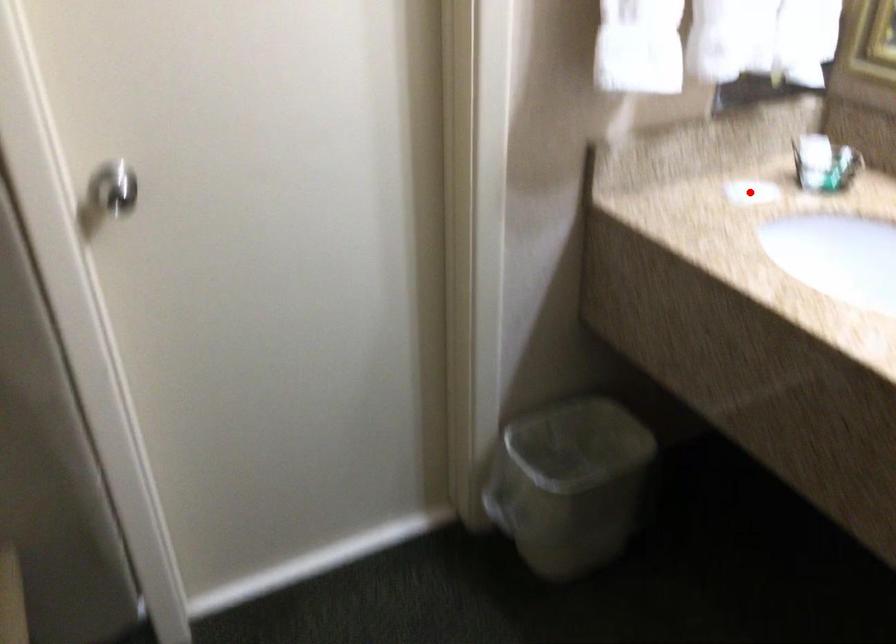
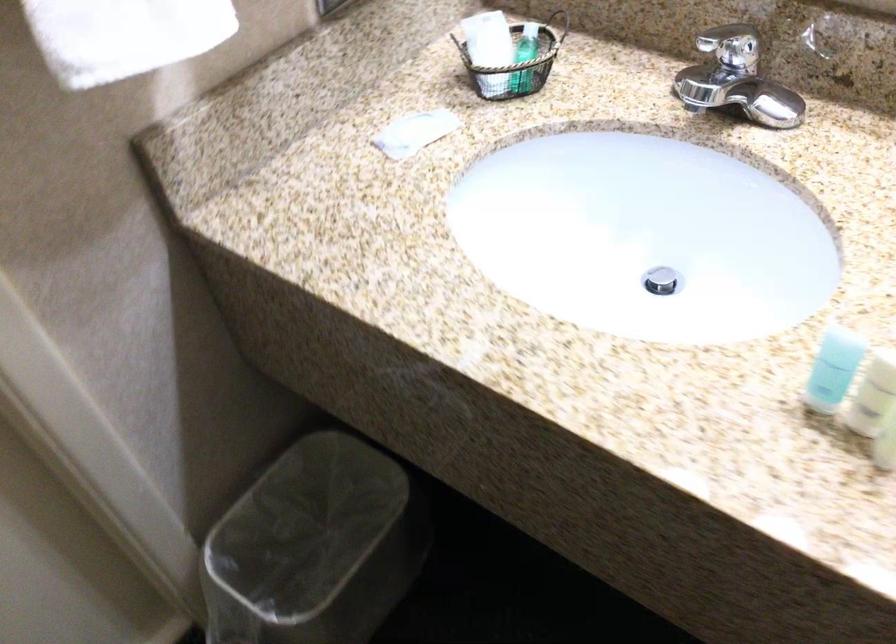
Question: I am providing you with two images of the same scene from different viewpoints. Given a red point in image1, look at the same physical point in image2. Is it:

Choices:
 (A) Closer to the viewpoint
 (B) Farther from the viewpoint

Answer: (A)